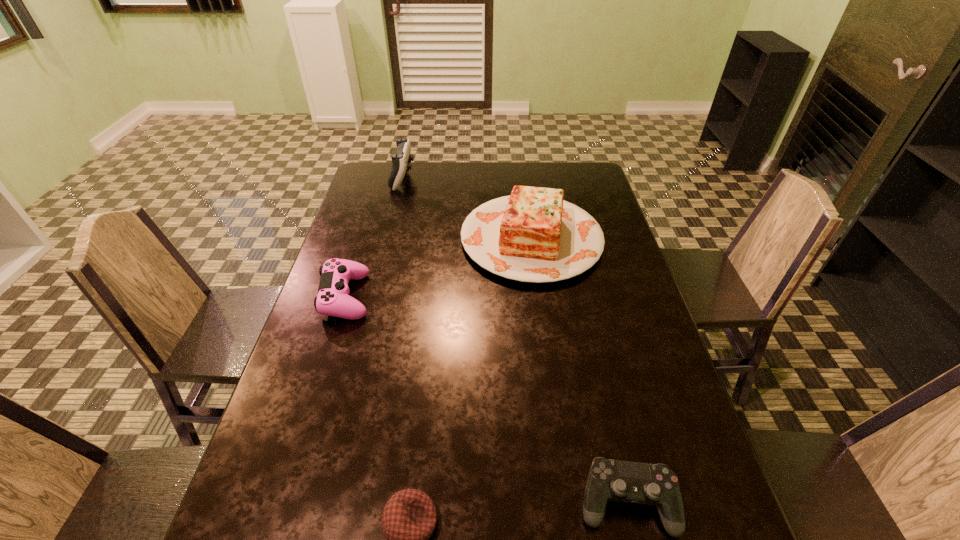
The width and height of the screenshot is (960, 540). Find the location of `the farthest control`. the farthest control is located at coordinates (400, 161).

This screenshot has width=960, height=540. I want to click on the tallest control, so click(400, 161).

At what (x,y) coordinates should I click in order to perform the action: click on lasagna. Please return your answer as a coordinate pair (x, y). This screenshot has width=960, height=540. Looking at the image, I should click on (533, 235).

This screenshot has width=960, height=540. Find the location of `the second nearest control`. the second nearest control is located at coordinates (332, 300).

At what (x,y) coordinates should I click in order to perform the action: click on free location located on the front-facing side of the tallest control. Please return your answer as a coordinate pair (x, y). The width and height of the screenshot is (960, 540). Looking at the image, I should click on (510, 178).

At what (x,y) coordinates should I click in order to perform the action: click on vacant space situated on the front of the lasagna. Please return your answer as a coordinate pair (x, y). This screenshot has height=540, width=960. Looking at the image, I should click on (553, 395).

This screenshot has width=960, height=540. In order to click on free spot located on the back of the second nearest control in this screenshot , I will do coord(371,218).

This screenshot has width=960, height=540. I want to click on object located at the far edge, so click(x=400, y=161).

In order to click on object that is at the right edge in this screenshot , I will do (x=533, y=235).

You are a GUI agent. You are given a task and a screenshot of the screen. Output one action in this format:
    pyautogui.click(x=<x>, y=<y>)
    Task: Click on the object that is at the far left corner
    The width and height of the screenshot is (960, 540).
    Given the screenshot: What is the action you would take?
    point(400,161)